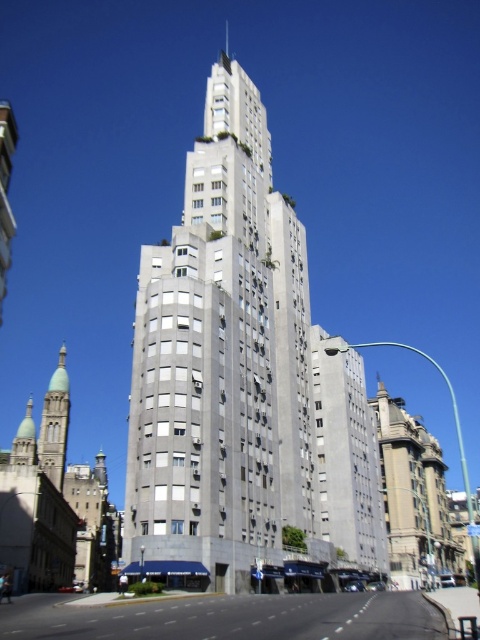
You are a city planner evaluating the urban landscape. Given the gray concrete building at center and the green stone minaret at left, which structure occupies a larger area in the image?

The gray concrete building at center is bigger than the green stone minaret at left, so it occupies a larger area in the image.

You are standing on the street in front of the gray concrete building at center and the green stone minaret at left. Which structure would appear larger to you?

The gray concrete building at center would appear larger because it is closer to you than the green stone minaret at left.

You are standing on the sidewalk next to the gray concrete building at center. You want to take a photo of the entire building in one frame. Considering the camera you have can capture a maximum distance of 50 meters, will you be able to capture the entire building without moving closer?

The gray concrete building at center is 52.58 meters away from camera, so no, you cannot capture the entire building in one frame without moving closer because the distance exceeds the camera maximum of 50 meters.